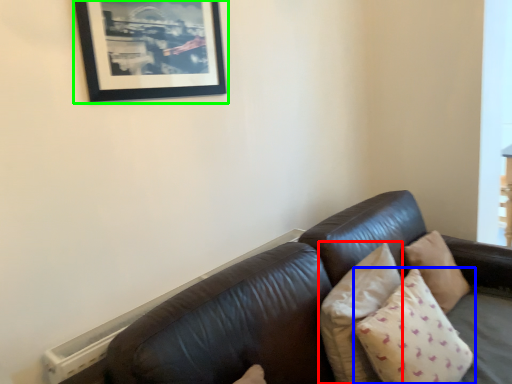
Question: Which object is positioned farthest from pillow (highlighted by a red box)? Select from pillow (highlighted by a blue box) and picture frame (highlighted by a green box).

Choices:
 (A) pillow
 (B) picture frame

Answer: (B)